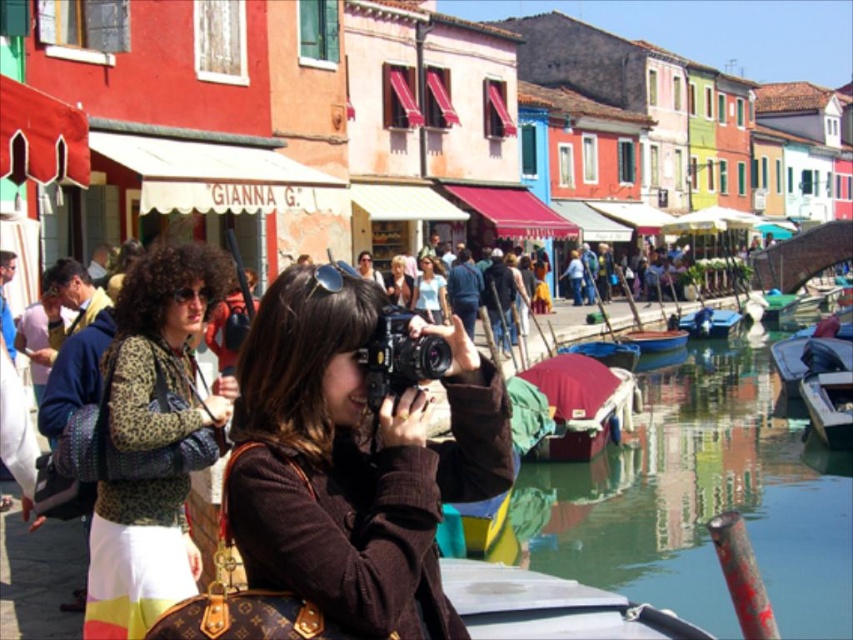
Question: Based on their relative distances, which object is nearer to the metallic silver boat at lower right?

Choices:
 (A) blue painted wooden boat at center
 (B) light blue cotton shirt at center

Answer: (A)

Question: Which point appears closest to the camera in this image?

Choices:
 (A) (306, 266)
 (B) (605, 397)

Answer: (A)

Question: Can you confirm if brown fabric camera at center is smaller than black plastic camera at center?

Choices:
 (A) no
 (B) yes

Answer: (A)

Question: Is leopard print sweater at center positioned before metallic silver boat at lower right?

Choices:
 (A) no
 (B) yes

Answer: (B)

Question: Which object appears farthest from the camera in this image?

Choices:
 (A) light blue cotton shirt at center
 (B) blue painted wooden boat at center
 (C) blue plastic boat at center
 (D) blonde hair at center

Answer: (C)

Question: Is leopard print sweater at center bigger than maroon fabric boat at center?

Choices:
 (A) no
 (B) yes

Answer: (A)